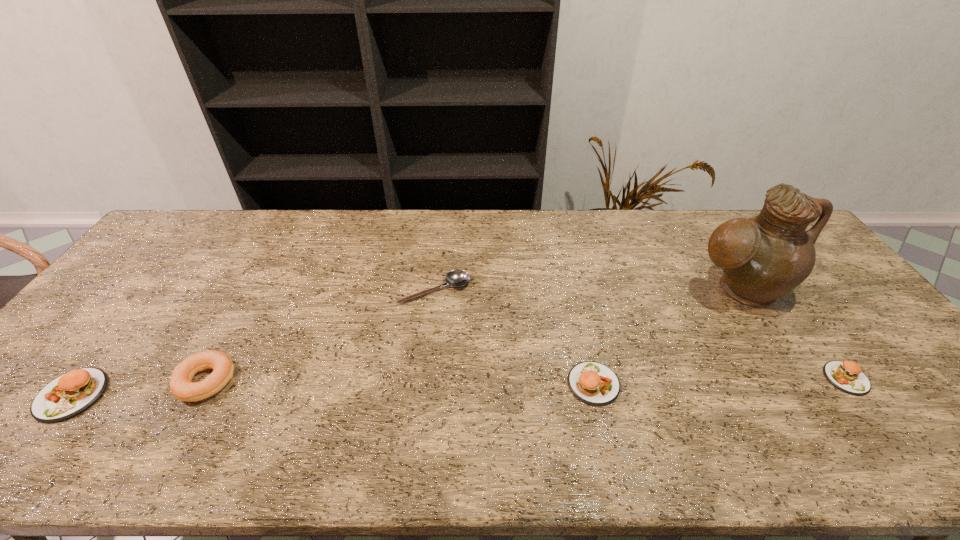
At what (x,y) coordinates should I click in order to perform the action: click on object present at the near right corner. Please return your answer as a coordinate pair (x, y). Looking at the image, I should click on (847, 376).

In the image, there is a desktop. Identify the location of blank space at the far edge. (537, 212).

Where is `free space at the near edge of the desktop`? The width and height of the screenshot is (960, 540). free space at the near edge of the desktop is located at coordinates (566, 389).

Locate an element on the screen. free space at the left edge is located at coordinates (139, 313).

Locate an element on the screen. This screenshot has height=540, width=960. empty location between the third object from left to right and the fifth object from right to left is located at coordinates (321, 335).

This screenshot has width=960, height=540. Identify the location of vacant area that lies between the ladle and the tallest patty. (253, 342).

The height and width of the screenshot is (540, 960). I want to click on vacant space that's between the fourth object from left to right and the leftmost patty, so click(x=333, y=389).

Where is `free space between the shortest object and the second patty from left to right`? free space between the shortest object and the second patty from left to right is located at coordinates (515, 336).

Locate an element on the screen. This screenshot has height=540, width=960. free space between the third object from left to right and the rightmost patty is located at coordinates (640, 334).

Where is `vacant space that is in between the tallest object and the second patty from left to right`? vacant space that is in between the tallest object and the second patty from left to right is located at coordinates (666, 337).